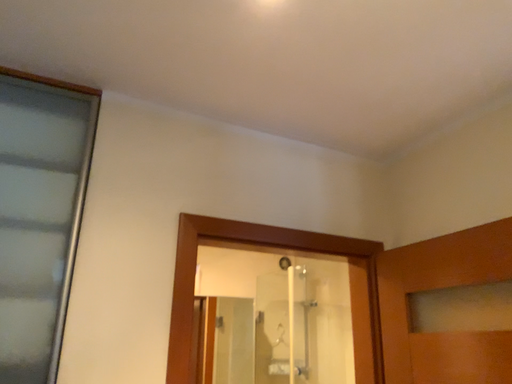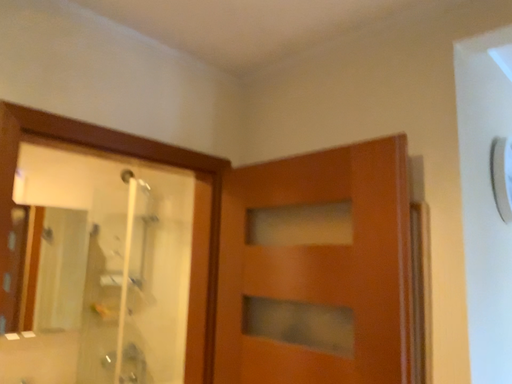
Question: Which way did the camera rotate in the video?

Choices:
 (A) rotated upward
 (B) rotated downward

Answer: (B)